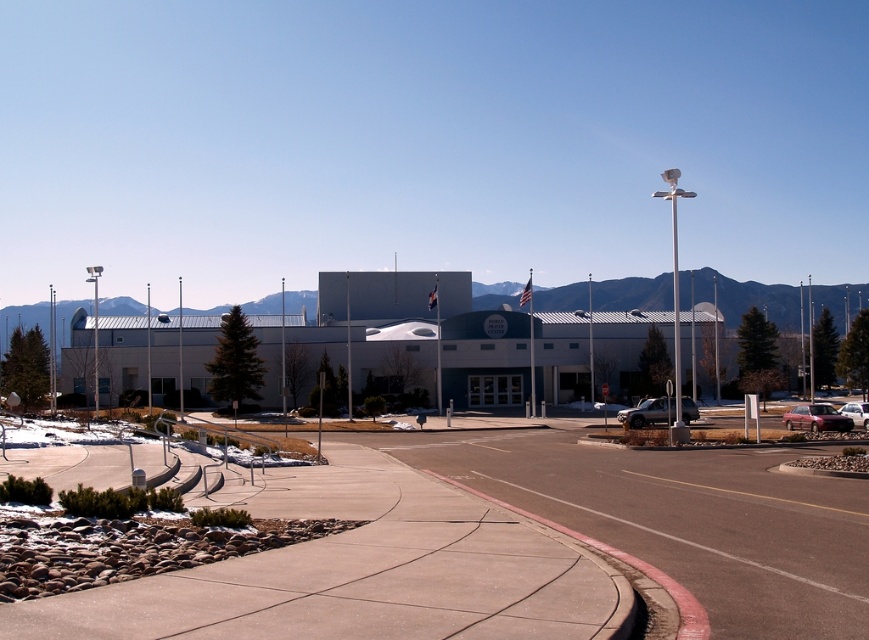
Question: Can you confirm if concrete at center is bigger than white glossy sedan at right?

Choices:
 (A) no
 (B) yes

Answer: (A)

Question: Which point appears closest to the camera in this image?

Choices:
 (A) (641, 410)
 (B) (800, 428)
 (C) (850, 410)
 (D) (244, 627)

Answer: (D)

Question: Is concrete at center smaller than satin silver sedan at lower right?

Choices:
 (A) no
 (B) yes

Answer: (A)

Question: Which object is closer to the camera taking this photo?

Choices:
 (A) satin silver sedan at lower right
 (B) white glossy sedan at right
 (C) concrete at center
 (D) satin burgundy sedan at lower right

Answer: (C)

Question: Can you confirm if concrete at center is positioned to the right of white glossy sedan at right?

Choices:
 (A) no
 (B) yes

Answer: (A)

Question: Among these points, which one is farthest from the camera?

Choices:
 (A) (389, 596)
 (B) (801, 416)
 (C) (673, 401)
 (D) (861, 420)

Answer: (C)